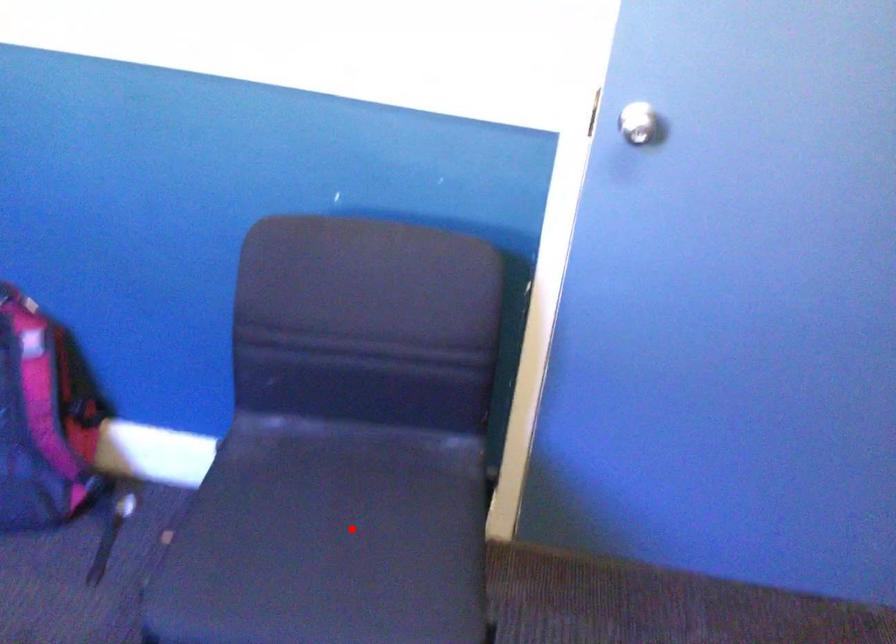
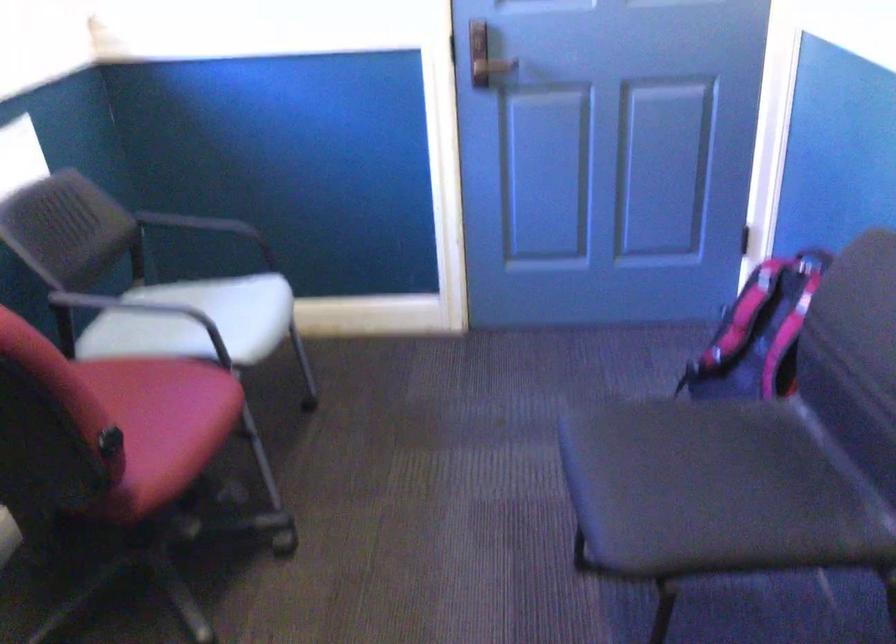
Question: I am providing you with two images of the same scene from different viewpoints. Given a red point in image1, look at the same physical point in image2. Is it:

Choices:
 (A) Closer to the viewpoint
 (B) Farther from the viewpoint

Answer: (B)